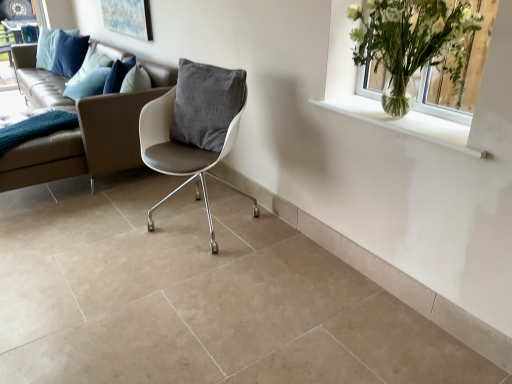
Question: From a real-world perspective, is matte glass window frame at upper left physically below white leather chair at center?

Choices:
 (A) no
 (B) yes

Answer: (A)

Question: Is matte glass window frame at upper left bigger than white leather chair at center?

Choices:
 (A) no
 (B) yes

Answer: (A)

Question: From a real-world perspective, is matte glass window frame at upper left over white leather chair at center?

Choices:
 (A) yes
 (B) no

Answer: (A)

Question: From the image's perspective, is matte glass window frame at upper left located above white leather chair at center?

Choices:
 (A) yes
 (B) no

Answer: (A)

Question: Is matte glass window frame at upper left not within white leather chair at center?

Choices:
 (A) no
 (B) yes

Answer: (B)

Question: Is point click(x=412, y=38) positioned closer to the camera than point click(x=159, y=160)?

Choices:
 (A) closer
 (B) farther

Answer: (A)

Question: From the image's perspective, is clear glass vase at upper right above or below white leather chair at center?

Choices:
 (A) below
 (B) above

Answer: (B)

Question: In terms of size, does clear glass vase at upper right appear bigger or smaller than white leather chair at center?

Choices:
 (A) small
 (B) big

Answer: (A)

Question: In terms of width, does clear glass vase at upper right look wider or thinner when compared to white leather chair at center?

Choices:
 (A) thin
 (B) wide

Answer: (A)

Question: Considering the positions of clear glass vase at upper right and clear glass vase at upper right in the image, is clear glass vase at upper right taller or shorter than clear glass vase at upper right?

Choices:
 (A) tall
 (B) short

Answer: (A)

Question: Is clear glass vase at upper right situated inside clear glass vase at upper right or outside?

Choices:
 (A) inside
 (B) outside

Answer: (B)

Question: Considering the positions of clear glass vase at upper right and clear glass vase at upper right in the image, is clear glass vase at upper right wider or thinner than clear glass vase at upper right?

Choices:
 (A) wide
 (B) thin

Answer: (A)

Question: In terms of size, does clear glass vase at upper right appear bigger or smaller than clear glass vase at upper right?

Choices:
 (A) big
 (B) small

Answer: (A)

Question: From their relative heights in the image, would you say leather couch at center is taller or shorter than clear glass vase at upper right?

Choices:
 (A) short
 (B) tall

Answer: (B)

Question: From the image's perspective, is leather couch at center positioned above or below clear glass vase at upper right?

Choices:
 (A) above
 (B) below

Answer: (A)